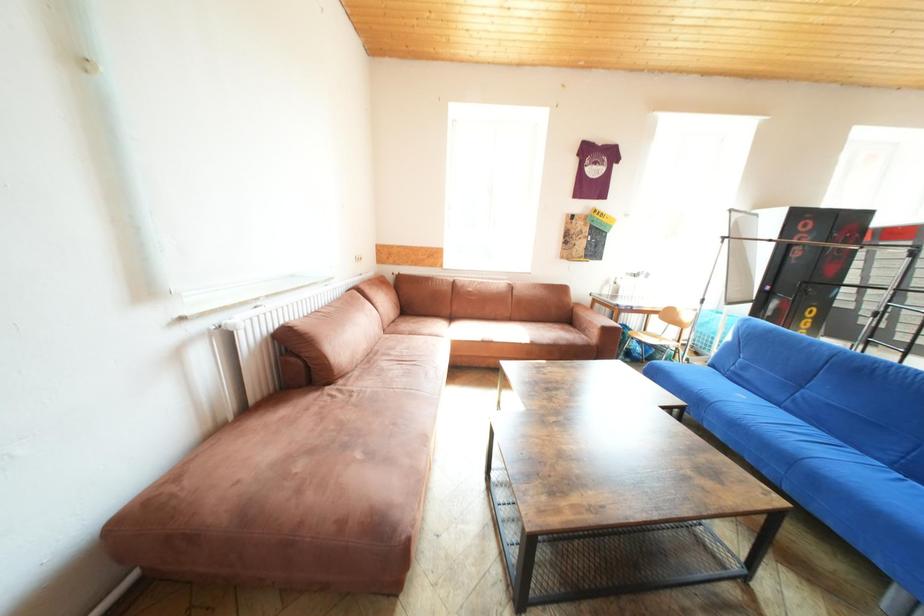
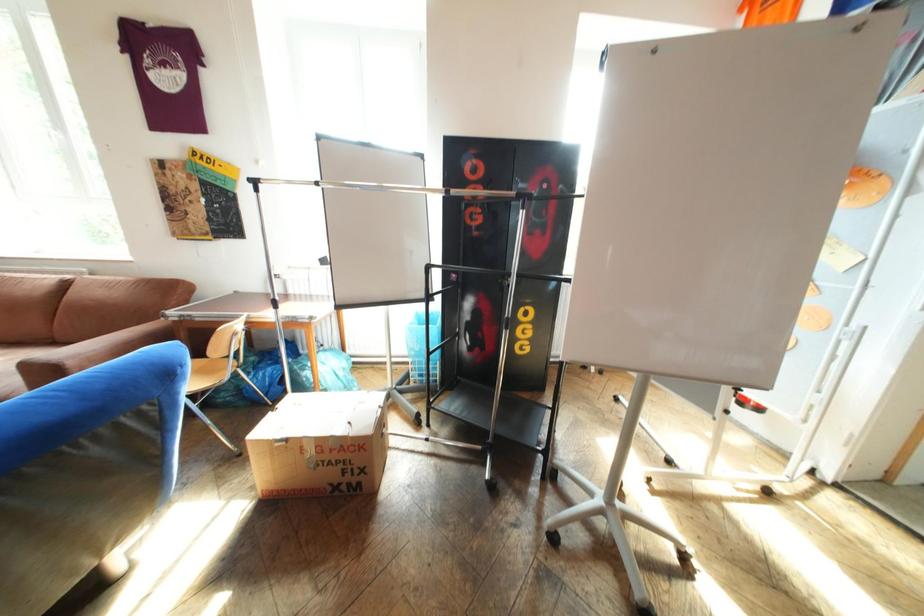
Question: The images are taken continuously from a first-person perspective. In which direction are you moving?

Choices:
 (A) Left
 (B) Right
 (C) Forward
 (D) Backward

Answer: (B)